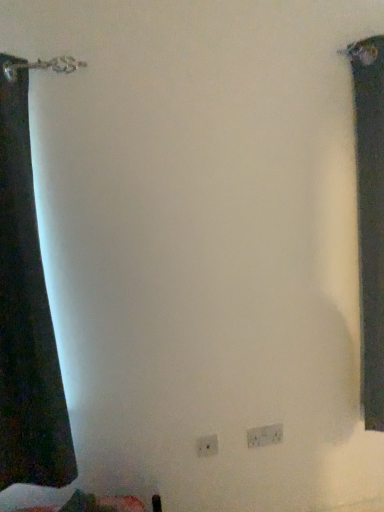
Question: From the image's perspective, is white plastic electric outlet at lower center, which is counted as the 2th electric outlet, starting from the front, beneath white plastic electric outlet at lower center, the 1th electric outlet when ordered from left to right?

Choices:
 (A) no
 (B) yes

Answer: (A)

Question: Does white plastic electric outlet at lower center, placed as the 2th electric outlet when sorted from left to right, lie in front of white plastic electric outlet at lower center, the first electric outlet from the front?

Choices:
 (A) no
 (B) yes

Answer: (A)

Question: Considering the relative positions of white plastic electric outlet at lower center, which ranks as the 1th electric outlet in back-to-front order, and white plastic electric outlet at lower center, the 1th electric outlet when ordered from left to right, in the image provided, is white plastic electric outlet at lower center, which ranks as the 1th electric outlet in back-to-front order, behind white plastic electric outlet at lower center, the 1th electric outlet when ordered from left to right,?

Choices:
 (A) no
 (B) yes

Answer: (B)

Question: Is white plastic electric outlet at lower center, which is counted as the 2th electric outlet, starting from the front, taller than white plastic electric outlet at lower center, the second electric outlet in the right-to-left sequence?

Choices:
 (A) no
 (B) yes

Answer: (B)

Question: From a real-world perspective, is white plastic electric outlet at lower center, which is counted as the first electric outlet, starting from the right, positioned over white plastic electric outlet at lower center, the first electric outlet from the front, based on gravity?

Choices:
 (A) no
 (B) yes

Answer: (A)

Question: From the image's perspective, is white plastic electric outlet at lower center, placed as the 2th electric outlet when sorted from left to right, located above white plastic electric outlet at lower center, the 1th electric outlet when ordered from left to right?

Choices:
 (A) no
 (B) yes

Answer: (B)

Question: Is white plastic electric outlet at lower center, which is counted as the 2th electric outlet, starting from the front, not inside dark fabric curtain at right?

Choices:
 (A) yes
 (B) no

Answer: (A)

Question: Can you confirm if white plastic electric outlet at lower center, which is counted as the 2th electric outlet, starting from the front, is taller than dark fabric curtain at right?

Choices:
 (A) no
 (B) yes

Answer: (A)

Question: Can you confirm if white plastic electric outlet at lower center, which ranks as the 1th electric outlet in back-to-front order, is thinner than dark fabric curtain at right?

Choices:
 (A) yes
 (B) no

Answer: (A)

Question: Is white plastic electric outlet at lower center, which ranks as the 1th electric outlet in back-to-front order, smaller than dark fabric curtain at right?

Choices:
 (A) yes
 (B) no

Answer: (A)

Question: Can you confirm if white plastic electric outlet at lower center, which is counted as the 2th electric outlet, starting from the front, is bigger than dark fabric curtain at right?

Choices:
 (A) no
 (B) yes

Answer: (A)

Question: From a real-world perspective, is white plastic electric outlet at lower center, which is counted as the 2th electric outlet, starting from the front, over dark fabric curtain at right?

Choices:
 (A) no
 (B) yes

Answer: (A)

Question: From a real-world perspective, is white plastic electric outlet at lower center, the second electric outlet in the right-to-left sequence, positioned over white plastic electric outlet at lower center, which is counted as the 2th electric outlet, starting from the front, based on gravity?

Choices:
 (A) no
 (B) yes

Answer: (B)